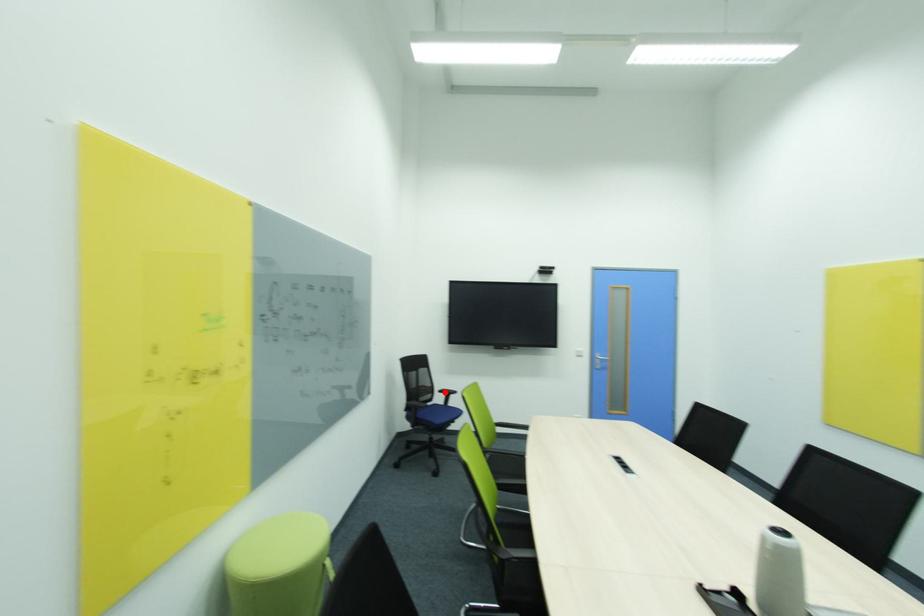
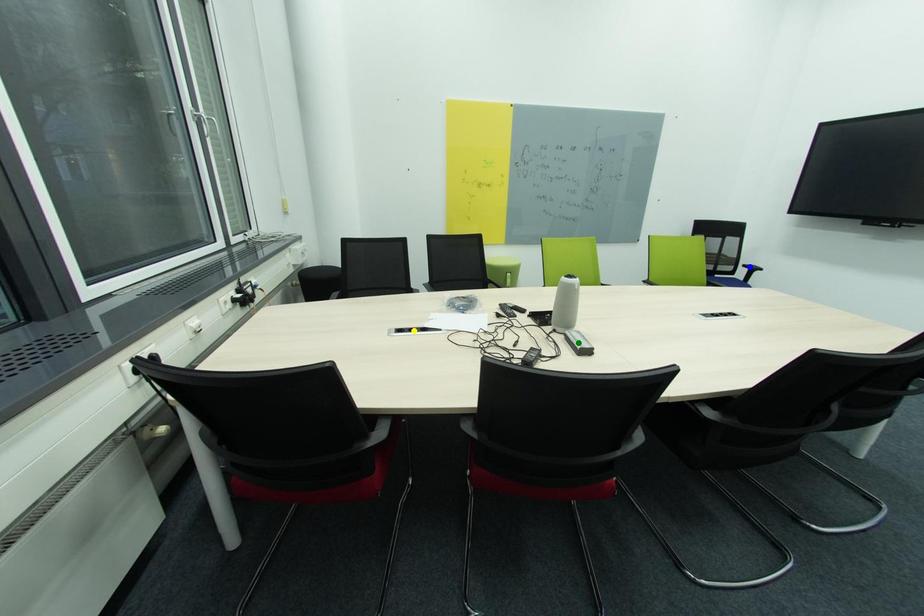
Question: I am providing you with two images of the same scene from different viewpoints. A red point is marked on the first image. You are given multiple points on the second image. In image 2, which mark is for the same physical point as the one in image 1?

Choices:
 (A) blue point
 (B) green point
 (C) yellow point

Answer: (A)